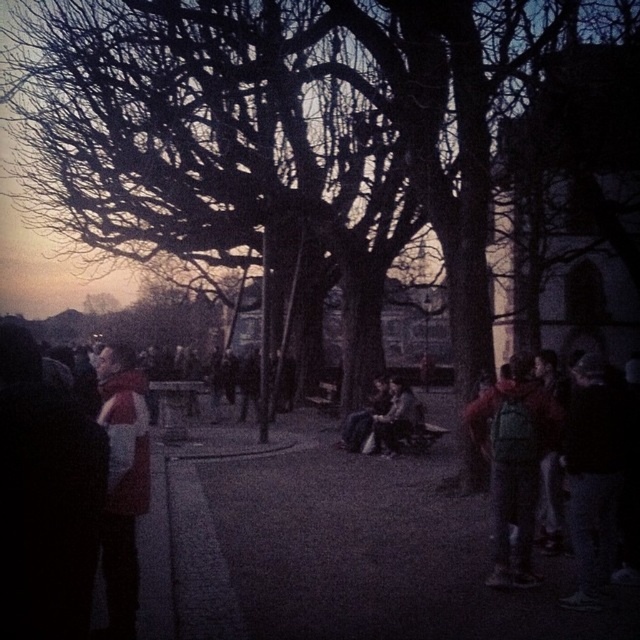
You are a photographer trying to capture a person wearing a dark brown leather jacket at center without including the bare branches at center in the frame. Given their relative sizes, is this possible?

The bare branches at center might be wider than dark brown leather jacket at center, so it may be challenging to frame the dark brown leather jacket at center without including the bare branches at center due to their potential width difference.

You are a pedestrian walking on the path and you see the red backpack at right and the matte red scarf at left. Which object is closer to you?

The distance between the red backpack at right and the matte red scarf at left is 11.95 feet, so the red backpack at right is closer to you since it is on the right side of the path and the scarf is on the left side.